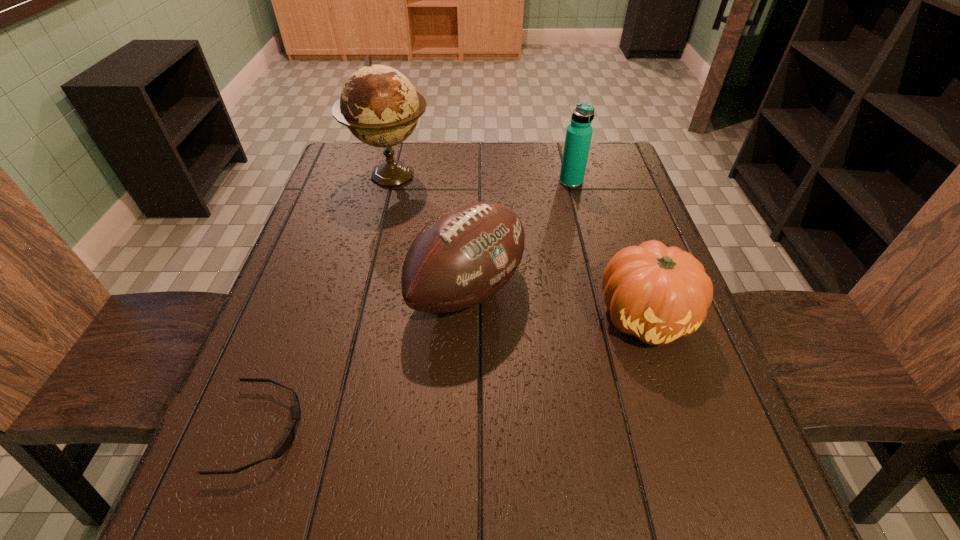
Identify the location of the tallest object. The width and height of the screenshot is (960, 540). (379, 105).

You are a GUI agent. You are given a task and a screenshot of the screen. Output one action in this format:
    pyautogui.click(x=<x>, y=<y>)
    Task: Click on the water bottle
    This screenshot has width=960, height=540.
    Given the screenshot: What is the action you would take?
    pyautogui.click(x=579, y=132)

The image size is (960, 540). What are the coordinates of `football (American)` in the screenshot? It's located at (465, 255).

This screenshot has width=960, height=540. What are the coordinates of `the fourth tallest object` in the screenshot? It's located at (657, 293).

I want to click on the shortest object, so click(x=288, y=440).

Locate an element on the screen. sunglasses is located at coordinates (288, 440).

Identify the location of vacant space located on the front of the globe showing Asia. (381, 216).

Find the location of a particular element. The width and height of the screenshot is (960, 540). free location located 0.320m on the left of the water bottle is located at coordinates (448, 182).

The image size is (960, 540). In order to click on free space located on the right of the football (American) in this screenshot , I will do `click(595, 290)`.

Find the location of a particular element. vacant area situated on the carved face of the pumpkin is located at coordinates (674, 402).